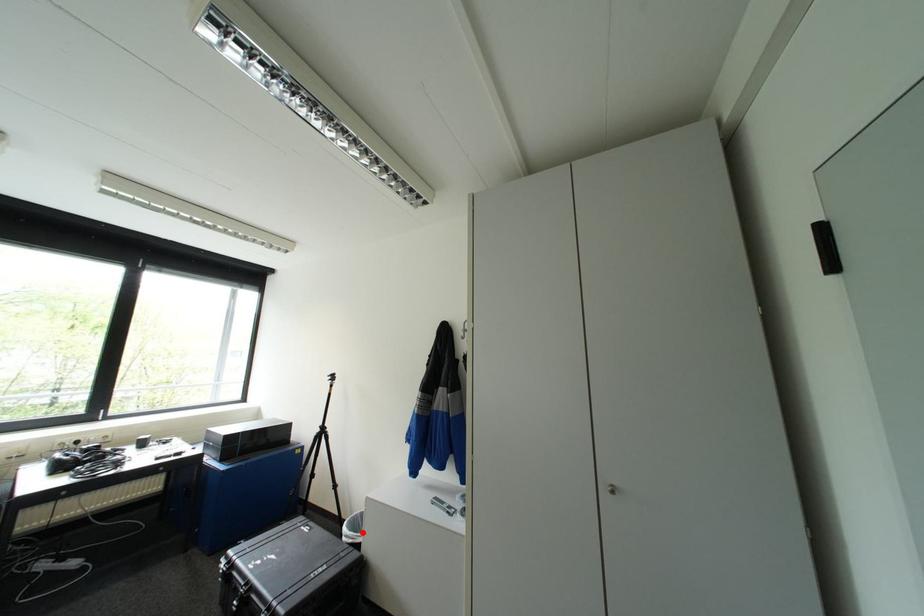
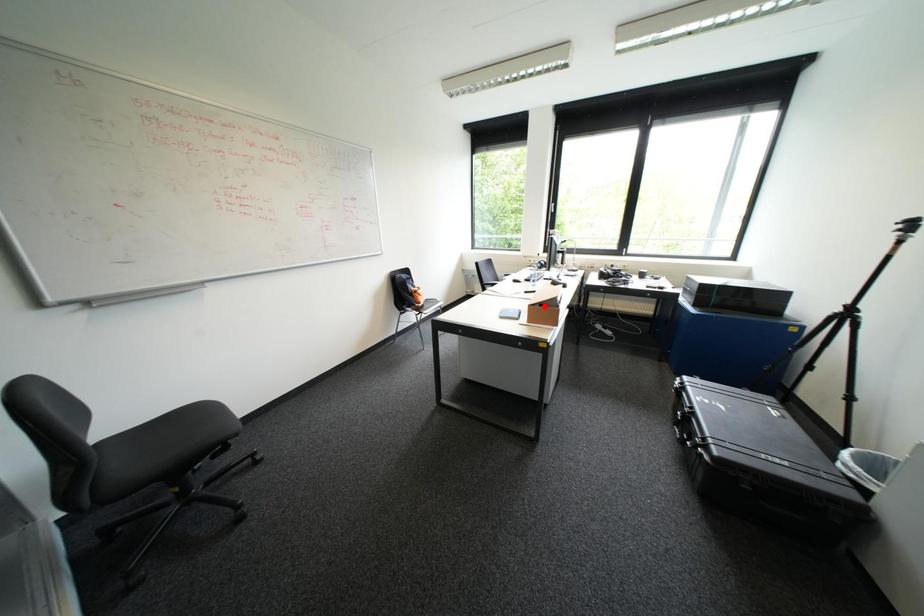
I am providing you with two images of the same scene from different viewpoints. A red point is marked on the first image and another point is marked on the second image. Is the red point in image1 aligned with the point shown in image2?

No